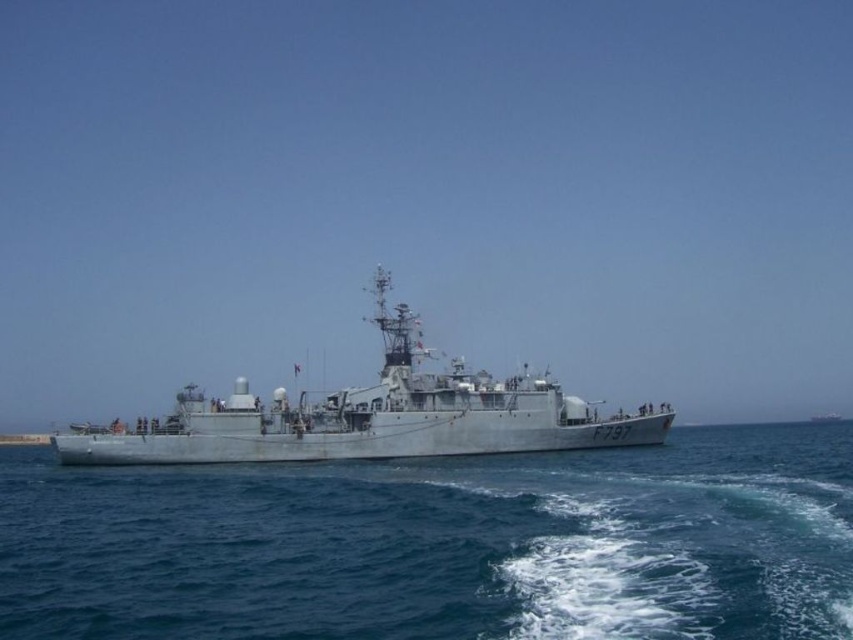
Measure the distance between blue water at center and gray metallic ship at center.

A distance of 55.93 feet exists between blue water at center and gray metallic ship at center.

In the scene shown: Is blue water at center wider than gray metallic ship at center?

→ Indeed, blue water at center has a greater width compared to gray metallic ship at center.

Is point (390, 497) in front of point (547, 428)?

Yes, it is.

The width and height of the screenshot is (853, 640). Find the location of `blue water at center`. blue water at center is located at coordinates (440, 545).